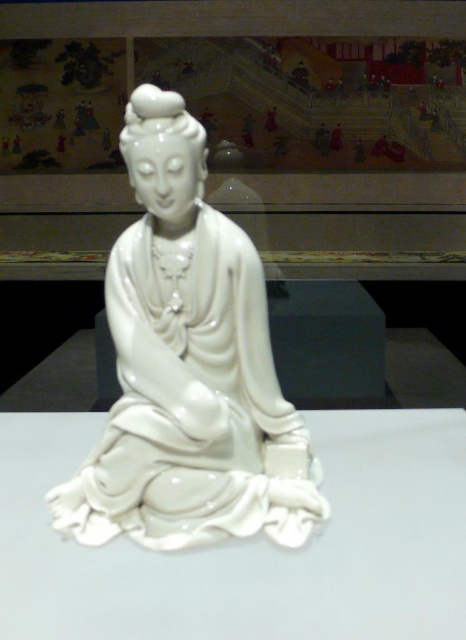
Question: Can you confirm if white glossy table at center is positioned to the left of glossy porcelain statue at center?

Choices:
 (A) no
 (B) yes

Answer: (A)

Question: Where is white glossy table at center located in relation to glossy porcelain statue at center in the image?

Choices:
 (A) left
 (B) right

Answer: (B)

Question: Does white glossy table at center lie in front of glossy porcelain statue at center?

Choices:
 (A) no
 (B) yes

Answer: (B)

Question: Which point is farther to the camera?

Choices:
 (A) (7, 536)
 (B) (185, 458)

Answer: (B)